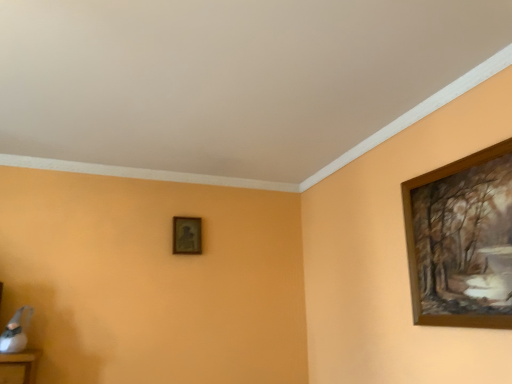
How much space does wooden picture frame at upper right, which is the second picture frame from left to right, occupy vertically?

27.35 inches.

Describe the element at coordinates (462, 241) in the screenshot. I see `wooden picture frame at upper right, acting as the first picture frame starting from the front` at that location.

Measure the distance between point (465, 160) and camera.

Point (465, 160) is 1.80 meters away from camera.

In order to face wooden picture frame at upper right, acting as the first picture frame starting from the front, should I rotate leftwards or rightwards?

Turn right approximately 25.588 degrees to face it.

The image size is (512, 384). What are the coordinates of `wooden picture frame at upper right, which ranks as the second picture frame in back-to-front order` in the screenshot? It's located at (462, 241).

Image resolution: width=512 pixels, height=384 pixels. What do you see at coordinates (187, 235) in the screenshot?
I see `matte gold picture frame at center, the 2th picture frame viewed from the front` at bounding box center [187, 235].

Find the location of a particular element. The width and height of the screenshot is (512, 384). matte gold picture frame at center, which appears as the second picture frame when viewed from the right is located at coordinates (187, 235).

How much space does matte gold picture frame at center, which appears as the second picture frame when viewed from the right, occupy horizontally?

It is 7.32 centimeters.

This screenshot has width=512, height=384. I want to click on wooden picture frame at upper right, acting as the first picture frame starting from the front, so click(462, 241).

Considering the positions of objects matte gold picture frame at center, which is counted as the first picture frame, starting from the back, and wooden picture frame at upper right, the 1th picture frame from the right, in the image provided, who is more to the right, matte gold picture frame at center, which is counted as the first picture frame, starting from the back, or wooden picture frame at upper right, the 1th picture frame from the right,?

From the viewer's perspective, wooden picture frame at upper right, the 1th picture frame from the right, appears more on the right side.

Is the position of matte gold picture frame at center, arranged as the 1th picture frame when viewed from the left, less distant than that of wooden picture frame at upper right, which is the second picture frame from left to right?

No, it is not.

Does point (177, 228) come closer to viewer compared to point (477, 240)?

No, (177, 228) is behind (477, 240).

From the image's perspective, is matte gold picture frame at center, which appears as the second picture frame when viewed from the right, located above wooden picture frame at upper right, which is the second picture frame from left to right?

No, from the image's perspective, matte gold picture frame at center, which appears as the second picture frame when viewed from the right, is not above wooden picture frame at upper right, which is the second picture frame from left to right.

From a real-world perspective, which object stands above the other?

In real-world perspective, matte gold picture frame at center, the 2th picture frame viewed from the front, is above.

Which object is wider, matte gold picture frame at center, which is counted as the first picture frame, starting from the back, or wooden picture frame at upper right, acting as the first picture frame starting from the front?

With larger width is matte gold picture frame at center, which is counted as the first picture frame, starting from the back.

Does matte gold picture frame at center, the 2th picture frame viewed from the front, have a lesser height compared to wooden picture frame at upper right, which is the second picture frame from left to right?

Indeed, matte gold picture frame at center, the 2th picture frame viewed from the front, has a lesser height compared to wooden picture frame at upper right, which is the second picture frame from left to right.

Is matte gold picture frame at center, which appears as the second picture frame when viewed from the right, smaller than wooden picture frame at upper right, acting as the first picture frame starting from the front?

Indeed, matte gold picture frame at center, which appears as the second picture frame when viewed from the right, has a smaller size compared to wooden picture frame at upper right, acting as the first picture frame starting from the front.

Based on the photo, is matte gold picture frame at center, which appears as the second picture frame when viewed from the right, outside of wooden picture frame at upper right, the 1th picture frame from the right?

Indeed, matte gold picture frame at center, which appears as the second picture frame when viewed from the right, is completely outside wooden picture frame at upper right, the 1th picture frame from the right.

Is matte gold picture frame at center, which appears as the second picture frame when viewed from the right, positioned far away from wooden picture frame at upper right, the 1th picture frame from the right?

That's right, there is a large distance between matte gold picture frame at center, which appears as the second picture frame when viewed from the right, and wooden picture frame at upper right, the 1th picture frame from the right.

From the picture: Is matte gold picture frame at center, which appears as the second picture frame when viewed from the right, oriented towards wooden picture frame at upper right, which is the second picture frame from left to right?

No.

How many degrees apart are the facing directions of matte gold picture frame at center, which is counted as the first picture frame, starting from the back, and wooden picture frame at upper right, acting as the first picture frame starting from the front?

The angular difference between matte gold picture frame at center, which is counted as the first picture frame, starting from the back, and wooden picture frame at upper right, acting as the first picture frame starting from the front, is 90.8 degrees.

Find the location of a particular element. This screenshot has height=384, width=512. picture frame below the matte gold picture frame at center, arranged as the 1th picture frame when viewed from the left (from a real-world perspective) is located at coordinates (462, 241).

In the image, is wooden picture frame at upper right, acting as the first picture frame starting from the front, on the left side or the right side of matte gold picture frame at center, the 2th picture frame viewed from the front?

Based on their positions, wooden picture frame at upper right, acting as the first picture frame starting from the front, is located to the right of matte gold picture frame at center, the 2th picture frame viewed from the front.

Which object is more forward, wooden picture frame at upper right, the 1th picture frame from the right, or matte gold picture frame at center, the 2th picture frame viewed from the front?

wooden picture frame at upper right, the 1th picture frame from the right, is in front.

Is point (464, 290) closer or farther from the camera than point (174, 223)?

Clearly, point (464, 290) is closer to the camera than point (174, 223).

From the image's perspective, is wooden picture frame at upper right, which is the second picture frame from left to right, located beneath matte gold picture frame at center, which appears as the second picture frame when viewed from the right?

No, from the image's perspective, wooden picture frame at upper right, which is the second picture frame from left to right, is not below matte gold picture frame at center, which appears as the second picture frame when viewed from the right.

From a real-world perspective, which is physically above, wooden picture frame at upper right, acting as the first picture frame starting from the front, or matte gold picture frame at center, which is counted as the first picture frame, starting from the back?

matte gold picture frame at center, which is counted as the first picture frame, starting from the back.

Can you confirm if wooden picture frame at upper right, which is the second picture frame from left to right, is thinner than matte gold picture frame at center, which is counted as the first picture frame, starting from the back?

Yes.

Considering the relative sizes of wooden picture frame at upper right, which is the second picture frame from left to right, and matte gold picture frame at center, which is counted as the first picture frame, starting from the back, in the image provided, is wooden picture frame at upper right, which is the second picture frame from left to right, taller than matte gold picture frame at center, which is counted as the first picture frame, starting from the back,?

Indeed, wooden picture frame at upper right, which is the second picture frame from left to right, has a greater height compared to matte gold picture frame at center, which is counted as the first picture frame, starting from the back.

In terms of size, does wooden picture frame at upper right, which ranks as the second picture frame in back-to-front order, appear bigger or smaller than matte gold picture frame at center, arranged as the 1th picture frame when viewed from the left?

wooden picture frame at upper right, which ranks as the second picture frame in back-to-front order, is bigger than matte gold picture frame at center, arranged as the 1th picture frame when viewed from the left.

Which is correct: wooden picture frame at upper right, which is the second picture frame from left to right, is inside matte gold picture frame at center, arranged as the 1th picture frame when viewed from the left, or outside of it?

wooden picture frame at upper right, which is the second picture frame from left to right, cannot be found inside matte gold picture frame at center, arranged as the 1th picture frame when viewed from the left.

Is wooden picture frame at upper right, the 1th picture frame from the right, touching matte gold picture frame at center, arranged as the 1th picture frame when viewed from the left?

No, wooden picture frame at upper right, the 1th picture frame from the right, is not in contact with matte gold picture frame at center, arranged as the 1th picture frame when viewed from the left.

Is wooden picture frame at upper right, which ranks as the second picture frame in back-to-front order, facing towards matte gold picture frame at center, arranged as the 1th picture frame when viewed from the left?

No.

Can you tell me how much wooden picture frame at upper right, acting as the first picture frame starting from the front, and matte gold picture frame at center, which appears as the second picture frame when viewed from the right, differ in facing direction?

They differ by 90.8 degrees in their facing directions.

How far apart are wooden picture frame at upper right, which ranks as the second picture frame in back-to-front order, and matte gold picture frame at center, which appears as the second picture frame when viewed from the right?

A distance of 1.67 meters exists between wooden picture frame at upper right, which ranks as the second picture frame in back-to-front order, and matte gold picture frame at center, which appears as the second picture frame when viewed from the right.

The image size is (512, 384). I want to click on picture frame located on the left of wooden picture frame at upper right, acting as the first picture frame starting from the front, so click(187, 235).

This screenshot has height=384, width=512. I want to click on picture frame that appears below the wooden picture frame at upper right, acting as the first picture frame starting from the front (from the image's perspective), so click(x=187, y=235).

The width and height of the screenshot is (512, 384). Identify the location of picture frame on the right side of matte gold picture frame at center, which is counted as the first picture frame, starting from the back. pos(462,241).